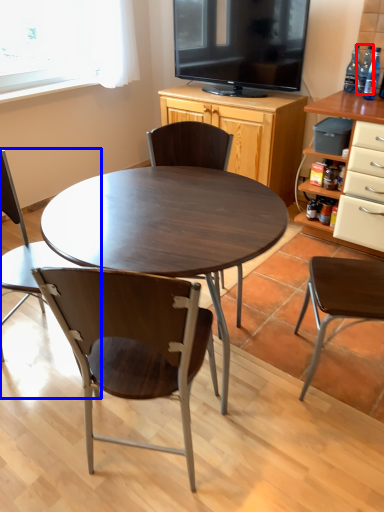
Question: Which of the following is the farthest to the observer, bottle (highlighted by a red box) or chair (highlighted by a blue box)?

Choices:
 (A) bottle
 (B) chair

Answer: (A)